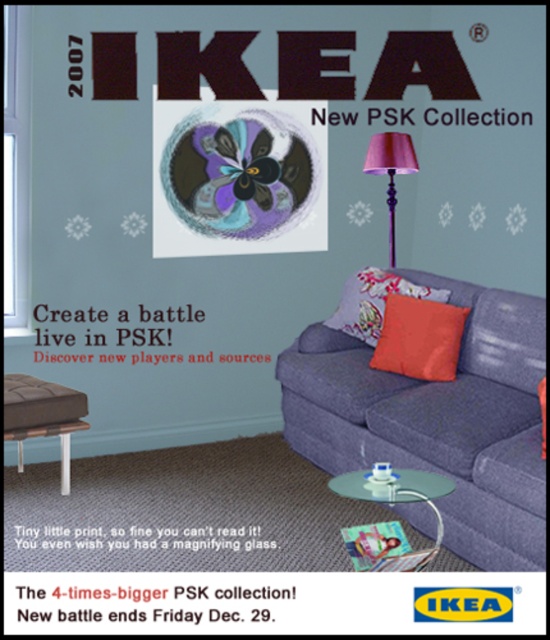
Does point (257, 156) lie in front of point (371, 276)?

No, (257, 156) is behind (371, 276).

What are the coordinates of `metallic flower at center` in the screenshot? It's located at (239, 177).

In the scene shown: Is textured blue couch at center bigger than purple fabric lampshade at upper right?

Yes.

Who is positioned more to the right, textured blue couch at center or purple fabric lampshade at upper right?

Positioned to the right is textured blue couch at center.

Does point (305, 394) come in front of point (408, 154)?

Yes, it is.

Find the location of a particular element. This screenshot has height=640, width=550. textured blue couch at center is located at coordinates (437, 419).

Who is higher up, orange matte cushion at center or matte plastic flyer at lower center?

orange matte cushion at center is higher up.

Which is in front, point (409, 310) or point (353, 557)?

Point (353, 557)

Where is `orange matte cushion at center`? The image size is (550, 640). orange matte cushion at center is located at coordinates (420, 339).